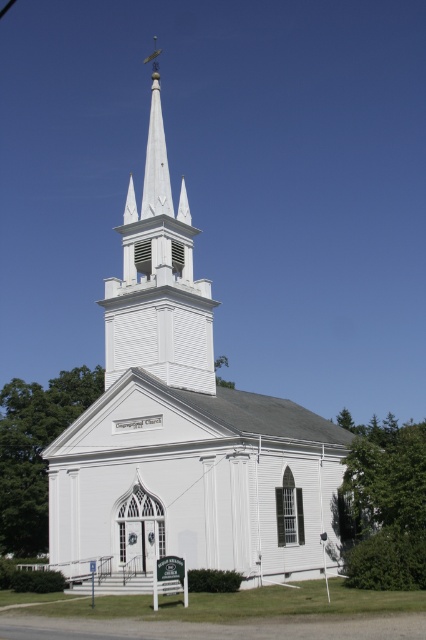
Question: Which point is closer to the camera?

Choices:
 (A) white wooden church at center
 (B) white wooden steeple at center

Answer: (A)

Question: Is white wooden church at center closer to the viewer compared to white wooden steeple at center?

Choices:
 (A) no
 (B) yes

Answer: (B)

Question: Considering the relative positions of white wooden church at center and white wooden steeple at center in the image provided, where is white wooden church at center located with respect to white wooden steeple at center?

Choices:
 (A) below
 (B) above

Answer: (B)

Question: Is white wooden church at center below white wooden steeple at center?

Choices:
 (A) yes
 (B) no

Answer: (B)